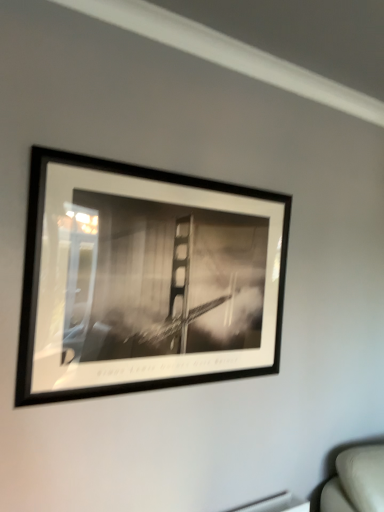
Consider the image. In order to face black matte picture frame at upper center, should I rotate leftwards or rightwards?

A 2.148 degree turn to the left will do.

Locate an element on the screen. The height and width of the screenshot is (512, 384). black matte picture frame at upper center is located at coordinates (145, 279).

The height and width of the screenshot is (512, 384). Describe the element at coordinates (145, 279) in the screenshot. I see `black matte picture frame at upper center` at that location.

The height and width of the screenshot is (512, 384). I want to click on black matte picture frame at upper center, so [145, 279].